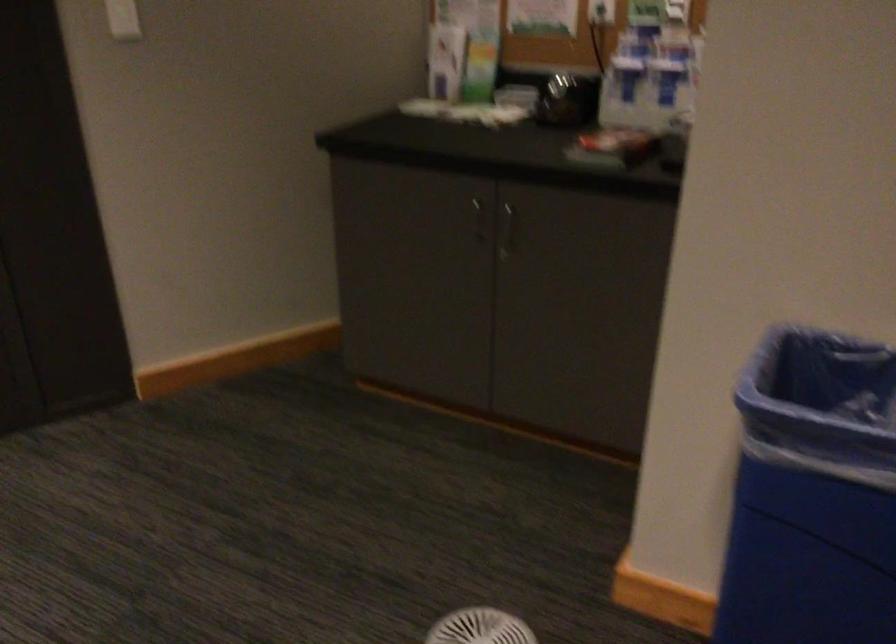
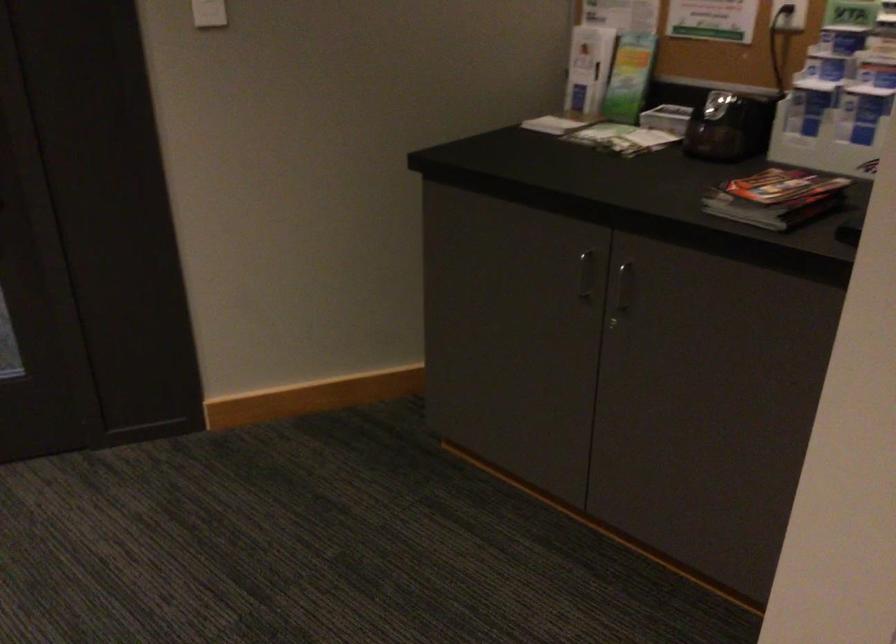
Locate, in the second image, the point that corresponds to point 511,228 in the first image.

(622, 292)